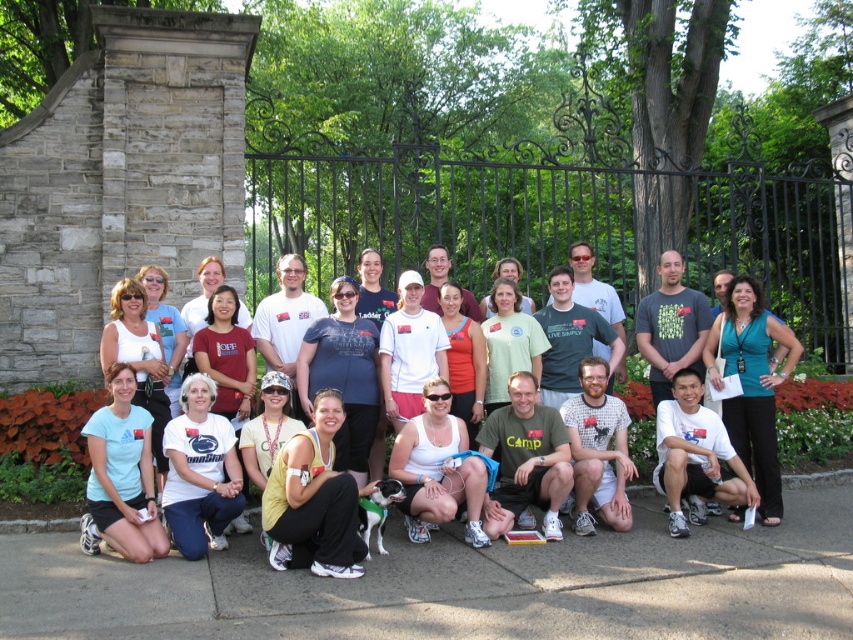
Question: Does matte white tank top at center appear over light green t-shirt at center?

Choices:
 (A) yes
 (B) no

Answer: (B)

Question: Does teal jersey at center have a greater width compared to white matte tank top at center?

Choices:
 (A) yes
 (B) no

Answer: (B)

Question: Estimate the real-world distances between objects in this image. Which object is closer to the white cotton shirt at center?

Choices:
 (A) light green t-shirt at center
 (B) white matte tank top at center
 (C) light blue t-shirt at lower left
 (D) teal jersey at center

Answer: (B)

Question: Can you confirm if light blue t-shirt at lower left is bigger than light green t-shirt at center?

Choices:
 (A) yes
 (B) no

Answer: (B)

Question: Which of these objects is positioned closest to the white matte tank top at center?

Choices:
 (A) light blue t-shirt at lower left
 (B) light green t-shirt at center
 (C) matte blue t-shirt at center
 (D) teal jersey at center

Answer: (C)

Question: Which point is farther to the camera?

Choices:
 (A) (364, 348)
 (B) (488, 300)

Answer: (B)